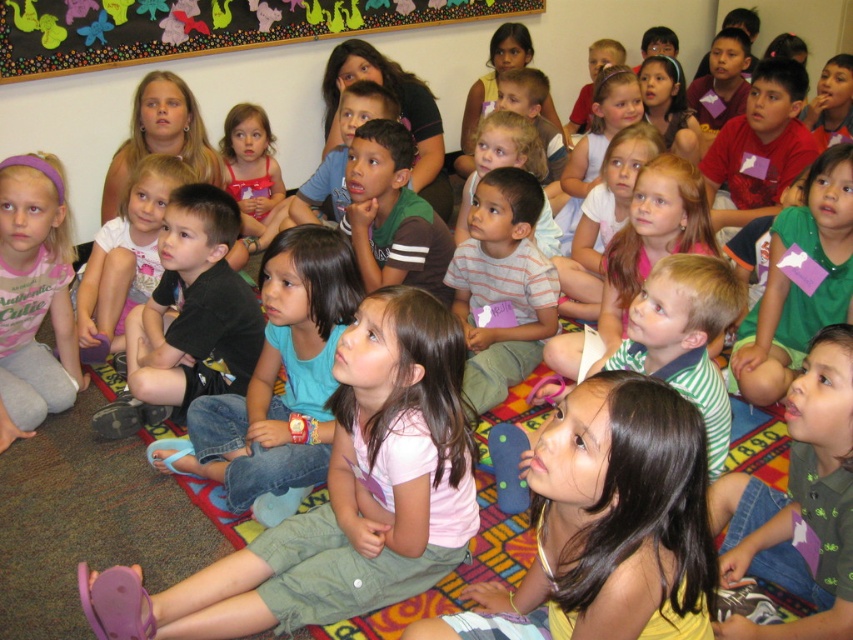
You are a teacher in the classroom and want to hang a poster on the wall directly above the multicolored paper butterflies at upper center. What coordinates should you aim for to place the poster correctly?

The multicolored paper butterflies at upper center are located at coordinates point (201, 26), so you should aim for the same coordinates to place the poster directly above them.

You are standing in the classroom and want to know how far the point at coordinates (456, 17) is from you. Can you determine the distance?

The distance of point (456, 17) from the camera is 4.74 meters.

Based on the photo, you are standing in the classroom and want to reach the point marked at coordinates (735, 486). If you can only move forward in a straight line, will you be able to reach that point without obstacles?

The point marked at coordinates (735, 486) is 6.37 feet away from the viewer. Since there are no obstacles mentioned in the scene description, you can move forward in a straight line to reach it.